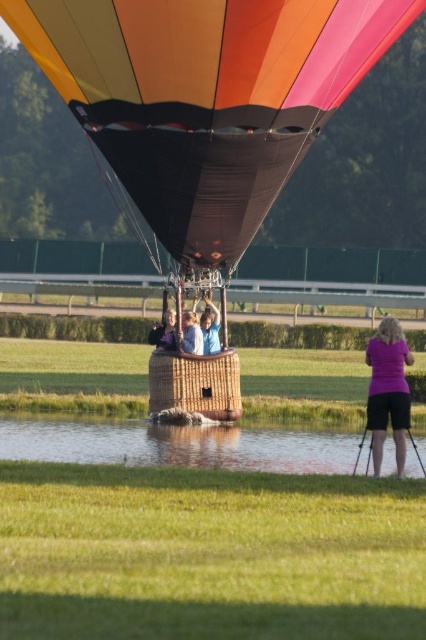
Does clear water at lower center have a smaller size compared to light blue denim jacket at center?

Actually, clear water at lower center might be larger than light blue denim jacket at center.

Image resolution: width=426 pixels, height=640 pixels. What do you see at coordinates (175, 444) in the screenshot? I see `clear water at lower center` at bounding box center [175, 444].

Image resolution: width=426 pixels, height=640 pixels. Find the location of `clear water at lower center`. clear water at lower center is located at coordinates (175, 444).

Where is `clear water at lower center`? clear water at lower center is located at coordinates [175, 444].

Between woven brown basket at center and light blue denim jacket at center, which one is positioned lower?

woven brown basket at center is lower down.

Measure the distance between woven brown basket at center and light blue denim jacket at center.

woven brown basket at center and light blue denim jacket at center are 91.33 centimeters apart from each other.

Is point (236, 397) closer to camera compared to point (147, 340)?

Yes, point (236, 397) is closer to viewer.

This screenshot has height=640, width=426. I want to click on woven brown basket at center, so click(x=195, y=384).

Which is more to the left, multicolored wicker basket at center or purple matte shorts at lower right?

Positioned to the left is multicolored wicker basket at center.

Is point (294, 118) positioned after point (374, 403)?

Yes, it is behind point (374, 403).

Where is `multicolored wicker basket at center`? Image resolution: width=426 pixels, height=640 pixels. multicolored wicker basket at center is located at coordinates (204, 104).